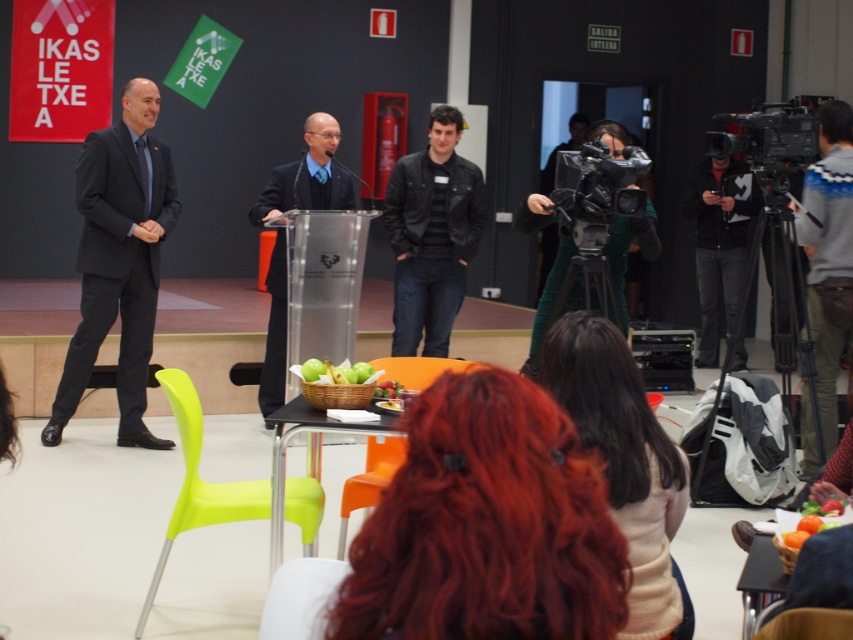
Question: Which point appears closest to the camera in this image?

Choices:
 (A) (283, 602)
 (B) (405, 380)
 (C) (793, 621)

Answer: (A)

Question: Is dark gray jacket at center closer to the viewer compared to orange plastic chair at center?

Choices:
 (A) yes
 (B) no

Answer: (B)

Question: Which point appears closest to the camera in this image?

Choices:
 (A) (471, 362)
 (B) (155, 264)

Answer: (A)

Question: Is the position of gray sweater at right more distant than that of wooden chair at lower right?

Choices:
 (A) no
 (B) yes

Answer: (B)

Question: Is gray sweater at right smaller than green plastic chair at lower center?

Choices:
 (A) yes
 (B) no

Answer: (B)

Question: Which object is the closest to the orange plastic chair at center?

Choices:
 (A) green plastic chair at lower center
 (B) matte black suit at center
 (C) wooden chair at lower right
 (D) gray sweater at right

Answer: (A)